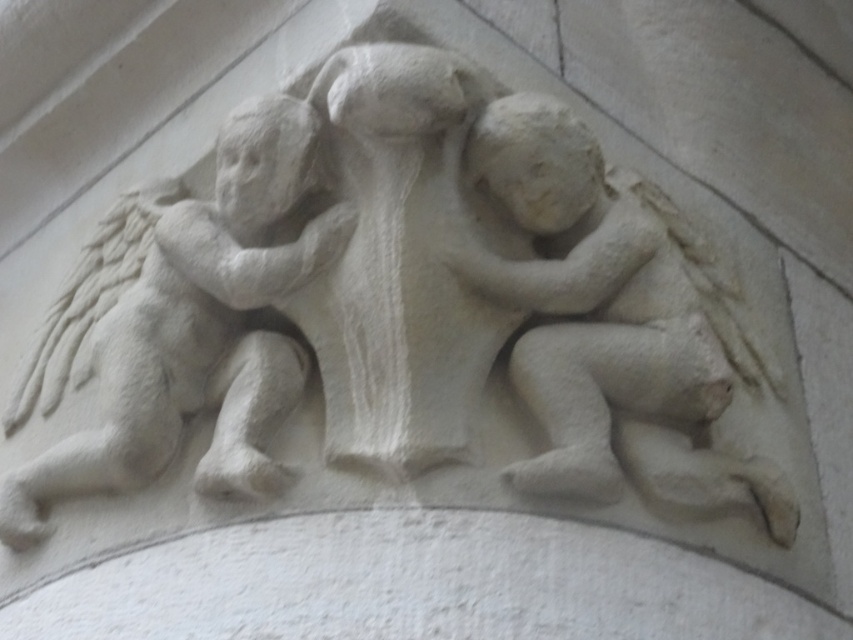
Who is shorter, white stone cherub at center or white stone cherub at upper left?

Standing shorter between the two is white stone cherub at center.

How much distance is there between white stone cherub at center and white stone cherub at upper left?

white stone cherub at center and white stone cherub at upper left are 2.09 meters apart.

What do you see at coordinates (612, 321) in the screenshot? I see `white stone cherub at center` at bounding box center [612, 321].

Find the location of a particular element. This screenshot has height=640, width=853. white stone cherub at center is located at coordinates (612, 321).